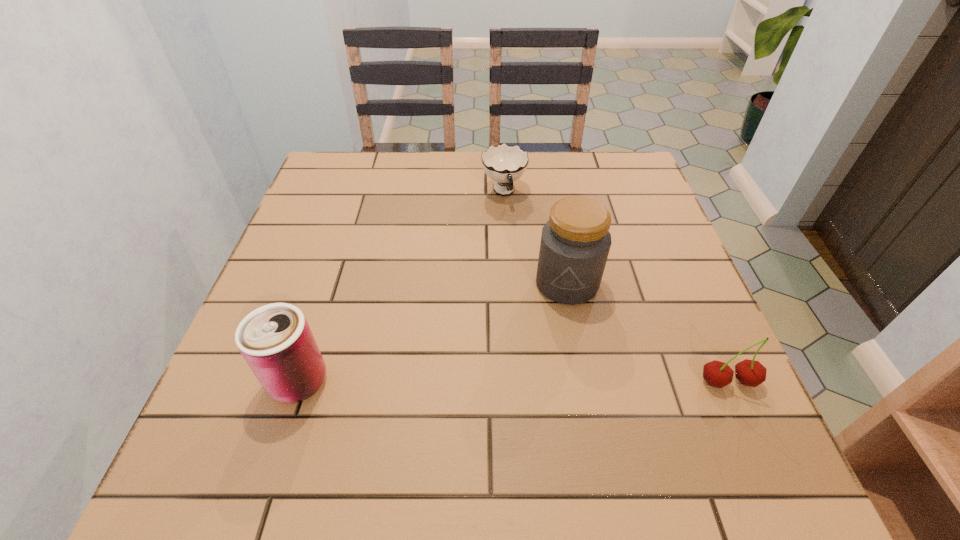
At what (x,y) coordinates should I click in order to perform the action: click on the third shortest object. Please return your answer as a coordinate pair (x, y). Image resolution: width=960 pixels, height=540 pixels. Looking at the image, I should click on (275, 340).

In order to click on the leftmost object in this screenshot , I will do `click(275, 340)`.

The width and height of the screenshot is (960, 540). What are the coordinates of `the rightmost object` in the screenshot? It's located at (752, 373).

This screenshot has height=540, width=960. Find the location of `the third tallest object`. the third tallest object is located at coordinates (752, 373).

The height and width of the screenshot is (540, 960). What are the coordinates of `jar` in the screenshot? It's located at (575, 242).

At what (x,y) coordinates should I click in order to perform the action: click on the tallest object. Please return your answer as a coordinate pair (x, y). Looking at the image, I should click on (575, 242).

The height and width of the screenshot is (540, 960). In order to click on cup in this screenshot , I will do `click(504, 164)`.

Locate an element on the screen. Image resolution: width=960 pixels, height=540 pixels. the farthest object is located at coordinates (504, 164).

Find the location of a particular element. vacant space located 0.080m on the back of the leftmost object is located at coordinates point(317,322).

Locate an element on the screen. The height and width of the screenshot is (540, 960). free region located on the surface of the jar near the warning symbol is located at coordinates (x=529, y=404).